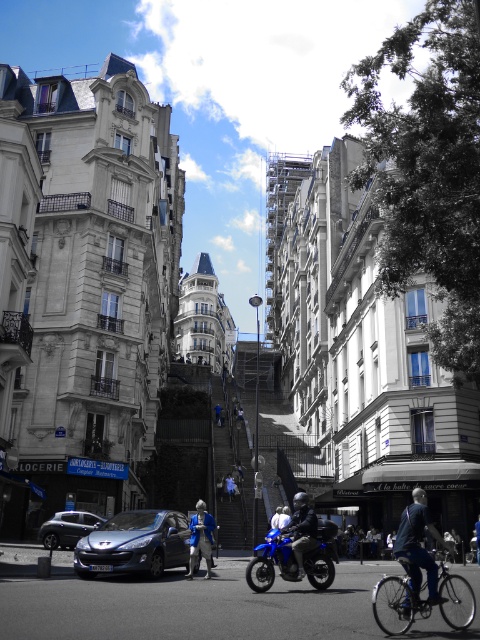
Does metallic blue hatchback at center come in front of blue matte bicycle at lower right?

That is False.

Does metallic blue hatchback at center have a greater width compared to blue matte bicycle at lower right?

Yes, metallic blue hatchback at center is wider than blue matte bicycle at lower right.

The height and width of the screenshot is (640, 480). Describe the element at coordinates (134, 545) in the screenshot. I see `metallic blue hatchback at center` at that location.

You are a GUI agent. You are given a task and a screenshot of the screen. Output one action in this format:
    pyautogui.click(x=<x>, y=<y>)
    Task: Click on the metallic blue hatchback at center
    The height and width of the screenshot is (640, 480).
    Given the screenshot: What is the action you would take?
    pyautogui.click(x=134, y=545)

How much distance is there between blue metallic motorcycle at center and blue matte bicycle at lower right?

7.61 meters

Is point (269, 534) in front of point (440, 609)?

No, (269, 534) is further to viewer.

The height and width of the screenshot is (640, 480). What do you see at coordinates (296, 548) in the screenshot?
I see `blue metallic motorcycle at center` at bounding box center [296, 548].

The image size is (480, 640). What are the coordinates of `blue metallic motorcycle at center` in the screenshot? It's located at (296, 548).

How distant is blue matte bicycle at lower right from blue fabric jacket at center?

blue matte bicycle at lower right is 16.83 meters away from blue fabric jacket at center.

Based on the photo, does blue matte bicycle at lower right have a lesser width compared to blue fabric jacket at center?

In fact, blue matte bicycle at lower right might be wider than blue fabric jacket at center.

Which is in front, point (377, 604) or point (210, 561)?

Positioned in front is point (377, 604).

In order to click on blue matte bicycle at lower right in this screenshot , I will do `click(396, 604)`.